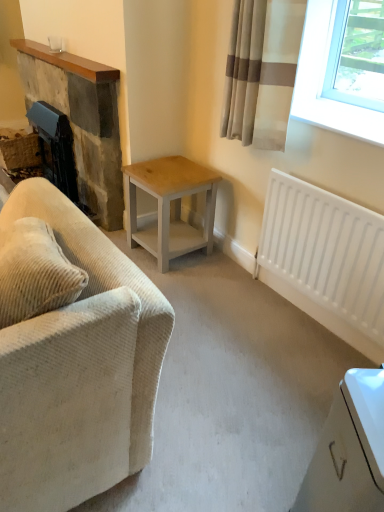
Image resolution: width=384 pixels, height=512 pixels. In order to click on vacant area that is in front of white matte radiator at lower right in this screenshot , I will do `click(295, 373)`.